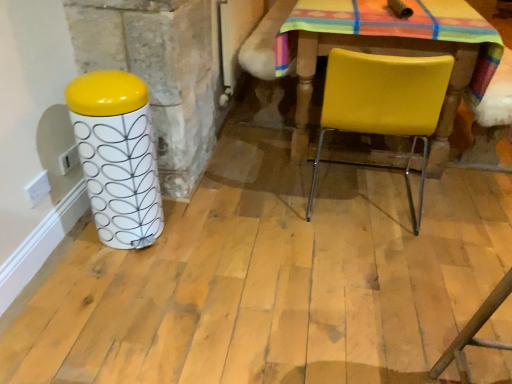
At what (x,y) coordinates should I click in order to perform the action: click on free point behind yellow leather chair at center. Please return your answer as a coordinate pair (x, y). The image size is (512, 384). Looking at the image, I should click on (345, 155).